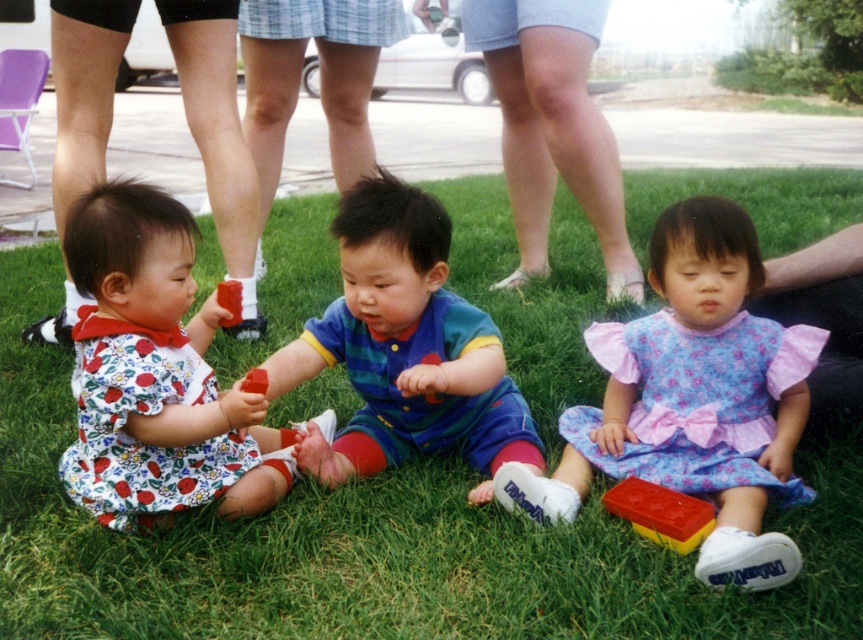
Question: Which point is farther to the camera?

Choices:
 (A) floral cotton dress at lower left
 (B) yellow rubber block at lower center
 (C) striped cotton onesie at center
 (D) floral cotton dress at lower right

Answer: (C)

Question: Which object is farther from the camera taking this photo?

Choices:
 (A) floral fabric dress at left
 (B) floral cotton dress at lower left
 (C) floral cotton dress at lower right
 (D) striped cotton onesie at center

Answer: (A)

Question: Does striped cotton onesie at center appear on the right side of yellow rubber block at lower center?

Choices:
 (A) yes
 (B) no

Answer: (B)

Question: Can you confirm if floral cotton dress at lower right is positioned above floral fabric dress at left?

Choices:
 (A) no
 (B) yes

Answer: (A)

Question: Considering the relative positions of green grass at center and floral fabric dress at left in the image provided, where is green grass at center located with respect to floral fabric dress at left?

Choices:
 (A) left
 (B) right

Answer: (B)

Question: Which is farther from the floral fabric dress at left?

Choices:
 (A) striped cotton onesie at center
 (B) green grass at center
 (C) yellow rubber block at lower center
 (D) floral cotton dress at lower right

Answer: (C)